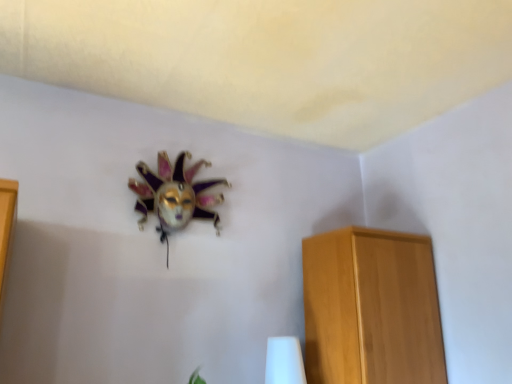
Describe the element at coordinates (175, 195) in the screenshot. This screenshot has width=512, height=384. I see `metallic mask at upper center` at that location.

What do you see at coordinates (371, 308) in the screenshot? I see `light brown wooden cabinet at right` at bounding box center [371, 308].

Where is `light brown wooden cabinet at right`? The height and width of the screenshot is (384, 512). light brown wooden cabinet at right is located at coordinates (371, 308).

Where is `metallic mask at upper center`? metallic mask at upper center is located at coordinates (175, 195).

Considering the sizes of objects white glossy table lamp at lower center and light brown wooden cabinet at right in the image provided, who is taller, white glossy table lamp at lower center or light brown wooden cabinet at right?

Standing taller between the two is light brown wooden cabinet at right.

Is white glossy table lamp at lower center turned away from light brown wooden cabinet at right?

That's not correct — white glossy table lamp at lower center is not looking away from light brown wooden cabinet at right.

How distant is white glossy table lamp at lower center from light brown wooden cabinet at right?

They are 14.13 inches apart.

Which object is wider, white glossy table lamp at lower center or light brown wooden cabinet at right?

light brown wooden cabinet at right is wider.

Which object is thinner, white glossy table lamp at lower center or metallic mask at upper center?

Thinner between the two is metallic mask at upper center.

Where is `table lamp located on the right of metallic mask at upper center`? table lamp located on the right of metallic mask at upper center is located at coordinates (284, 361).

From a real-world perspective, is white glossy table lamp at lower center under metallic mask at upper center?

Correct, in the physical world, white glossy table lamp at lower center is lower than metallic mask at upper center.

Can you see white glossy table lamp at lower center touching metallic mask at upper center?

No, white glossy table lamp at lower center is not next to metallic mask at upper center.

Is metallic mask at upper center not inside light brown wooden cabinet at right?

Indeed, metallic mask at upper center is completely outside light brown wooden cabinet at right.

Does metallic mask at upper center have a lesser width compared to light brown wooden cabinet at right?

Yes.

From a real-world perspective, is metallic mask at upper center located beneath light brown wooden cabinet at right?

No.

Looking at the image, does metallic mask at upper center seem bigger or smaller compared to light brown wooden cabinet at right?

metallic mask at upper center is smaller than light brown wooden cabinet at right.

Measure the distance between light brown wooden cabinet at right and white glossy table lamp at lower center.

light brown wooden cabinet at right is 35.90 centimeters from white glossy table lamp at lower center.

What's the angular difference between light brown wooden cabinet at right and white glossy table lamp at lower center's facing directions?

The angle between the facing direction of light brown wooden cabinet at right and the facing direction of white glossy table lamp at lower center is 0.901 degrees.

Considering the sizes of objects light brown wooden cabinet at right and white glossy table lamp at lower center in the image provided, who is smaller, light brown wooden cabinet at right or white glossy table lamp at lower center?

white glossy table lamp at lower center is smaller.

Locate an element on the screen. The height and width of the screenshot is (384, 512). table lamp directly beneath the light brown wooden cabinet at right (from a real-world perspective) is located at coordinates (284, 361).

In the scene shown: In terms of width, does light brown wooden cabinet at right look wider or thinner when compared to metallic mask at upper center?

Clearly, light brown wooden cabinet at right has more width compared to metallic mask at upper center.

Does light brown wooden cabinet at right lie behind metallic mask at upper center?

No, the depth of light brown wooden cabinet at right is less than that of metallic mask at upper center.

Is light brown wooden cabinet at right next to metallic mask at upper center?

No.

From a real-world perspective, which is physically below, light brown wooden cabinet at right or metallic mask at upper center?

light brown wooden cabinet at right is physically lower.

From the image's perspective, which is above, metallic mask at upper center or white glossy table lamp at lower center?

From the image's view, metallic mask at upper center is above.

Does metallic mask at upper center have a greater height compared to white glossy table lamp at lower center?

Yes.

Between metallic mask at upper center and white glossy table lamp at lower center, which one has larger size?

With larger size is metallic mask at upper center.

Where is `animal on the left of white glossy table lamp at lower center`? This screenshot has width=512, height=384. animal on the left of white glossy table lamp at lower center is located at coordinates (175, 195).

Identify the location of table lamp that appears below the light brown wooden cabinet at right (from a real-world perspective). (284, 361).

Where is `animal located above the white glossy table lamp at lower center (from the image's perspective)`? This screenshot has width=512, height=384. animal located above the white glossy table lamp at lower center (from the image's perspective) is located at coordinates (175, 195).

Which object lies further to the anchor point light brown wooden cabinet at right, metallic mask at upper center or white glossy table lamp at lower center?

metallic mask at upper center is positioned further to the anchor light brown wooden cabinet at right.

Based on their spatial positions, is white glossy table lamp at lower center or metallic mask at upper center closer to light brown wooden cabinet at right?

The object closer to light brown wooden cabinet at right is white glossy table lamp at lower center.

Considering their positions, is light brown wooden cabinet at right positioned further to white glossy table lamp at lower center than metallic mask at upper center?

metallic mask at upper center lies further to white glossy table lamp at lower center than the other object.

Which object lies nearer to the anchor point white glossy table lamp at lower center, metallic mask at upper center or light brown wooden cabinet at right?

light brown wooden cabinet at right is positioned closer to the anchor white glossy table lamp at lower center.

Looking at the image, which one is located further to metallic mask at upper center, light brown wooden cabinet at right or white glossy table lamp at lower center?

Based on the image, light brown wooden cabinet at right appears to be further to metallic mask at upper center.

From the image, which object appears to be nearer to metallic mask at upper center, white glossy table lamp at lower center or light brown wooden cabinet at right?

white glossy table lamp at lower center lies closer to metallic mask at upper center than the other object.

The height and width of the screenshot is (384, 512). Find the location of `table lamp located between metallic mask at upper center and light brown wooden cabinet at right in the left-right direction`. table lamp located between metallic mask at upper center and light brown wooden cabinet at right in the left-right direction is located at coordinates (284, 361).